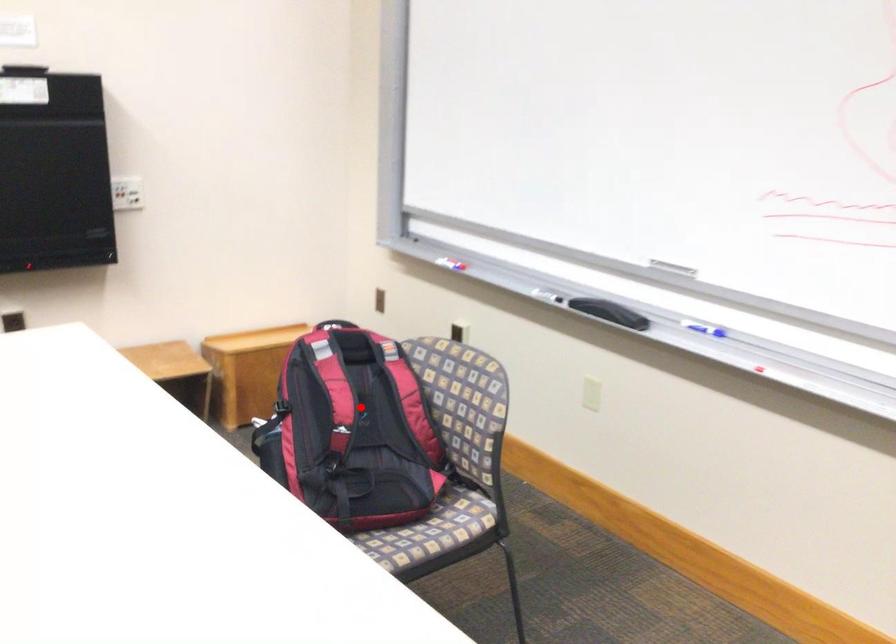
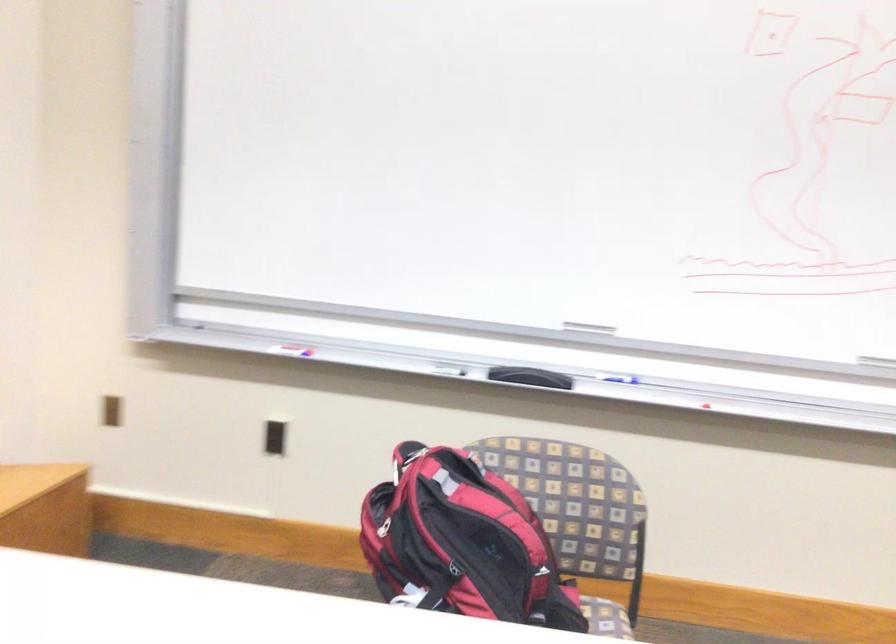
Locate, in the second image, the point that corresponds to the highlighted location in the first image.

(478, 542)